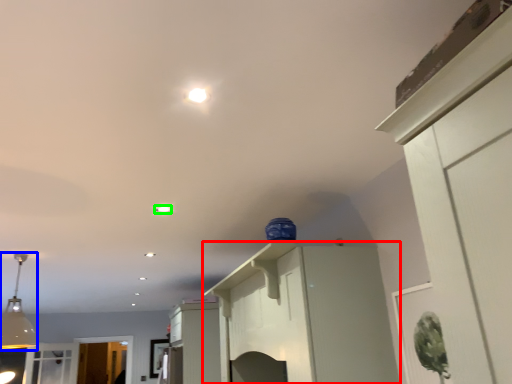
Question: Estimate the real-world distances between objects in this image. Which object is farther from cabinetry (highlighted by a red box), light fixture (highlighted by a blue box) or light (highlighted by a green box)?

Choices:
 (A) light fixture
 (B) light

Answer: (A)